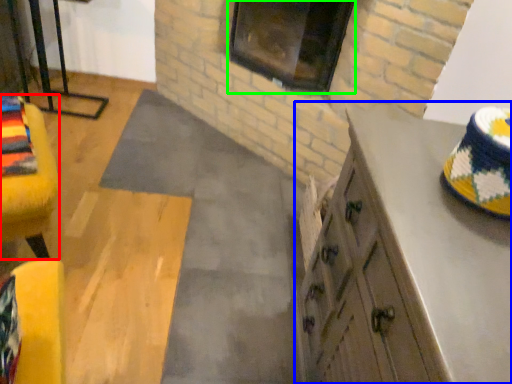
Question: Estimate the real-world distances between objects in this image. Which object is closer to furniture (highlighted by a red box), cabinetry (highlighted by a blue box) or window (highlighted by a green box)?

Choices:
 (A) cabinetry
 (B) window

Answer: (A)